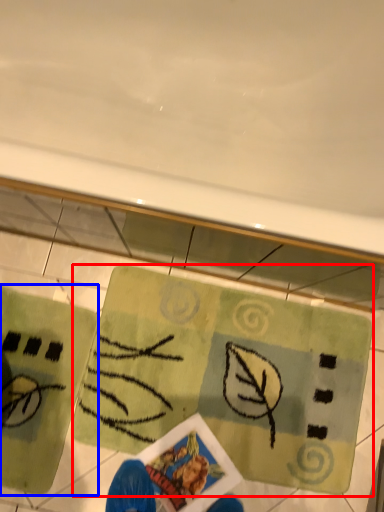
Question: Which point is further to the camera, yoga mat (highlighted by a red box) or yoga mat (highlighted by a blue box)?

Choices:
 (A) yoga mat
 (B) yoga mat

Answer: (A)